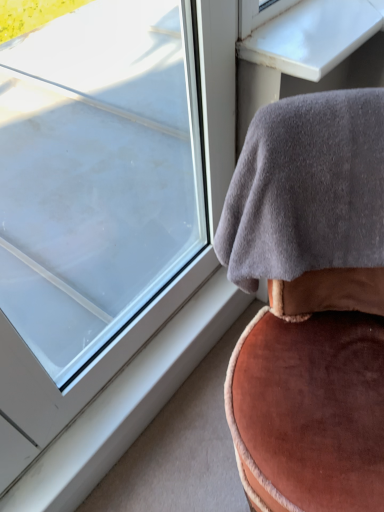
Question: Does transparent glass window at upper left have a greater height compared to gray fleece blanket at upper right?

Choices:
 (A) no
 (B) yes

Answer: (B)

Question: Is transparent glass window at upper left to the left of gray fleece blanket at upper right from the viewer's perspective?

Choices:
 (A) no
 (B) yes

Answer: (B)

Question: Is transparent glass window at upper left positioned with its back to gray fleece blanket at upper right?

Choices:
 (A) no
 (B) yes

Answer: (B)

Question: From a real-world perspective, is transparent glass window at upper left below gray fleece blanket at upper right?

Choices:
 (A) no
 (B) yes

Answer: (A)

Question: Does transparent glass window at upper left have a larger size compared to gray fleece blanket at upper right?

Choices:
 (A) no
 (B) yes

Answer: (B)

Question: In terms of size, does transparent glass window at upper left appear bigger or smaller than white plastic window sill at lower left?

Choices:
 (A) big
 (B) small

Answer: (A)

Question: Is transparent glass window at upper left in front of or behind white plastic window sill at lower left in the image?

Choices:
 (A) behind
 (B) front

Answer: (B)

Question: Considering the positions of point (148, 291) and point (203, 296), is point (148, 291) closer or farther from the camera than point (203, 296)?

Choices:
 (A) closer
 (B) farther

Answer: (A)

Question: In terms of width, does transparent glass window at upper left look wider or thinner when compared to white plastic window sill at lower left?

Choices:
 (A) wide
 (B) thin

Answer: (B)

Question: Relative to transparent glass window at upper left, is white glossy table at upper right in front or behind?

Choices:
 (A) behind
 (B) front

Answer: (A)

Question: From a real-world perspective, is white glossy table at upper right above or below transparent glass window at upper left?

Choices:
 (A) above
 (B) below

Answer: (A)

Question: Is white glossy table at upper right taller or shorter than transparent glass window at upper left?

Choices:
 (A) tall
 (B) short

Answer: (B)

Question: Is white glossy table at upper right bigger or smaller than transparent glass window at upper left?

Choices:
 (A) small
 (B) big

Answer: (A)

Question: Considering the positions of white plastic window sill at lower left and transparent glass window at upper left in the image, is white plastic window sill at lower left bigger or smaller than transparent glass window at upper left?

Choices:
 (A) small
 (B) big

Answer: (A)

Question: Is point (44, 497) closer or farther from the camera than point (104, 138)?

Choices:
 (A) closer
 (B) farther

Answer: (A)